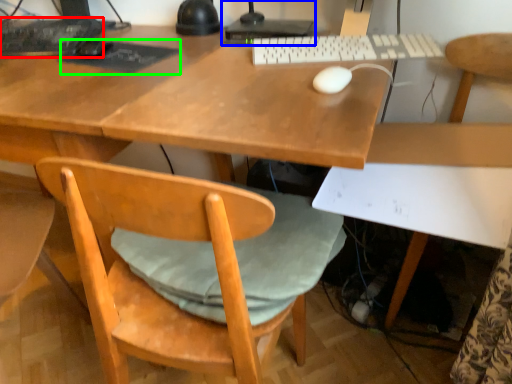
Question: Which object is the closest to the computer keyboard (highlighted by a red box)? Choose among these: desktop computer (highlighted by a blue box) or mousepad (highlighted by a green box).

Choices:
 (A) desktop computer
 (B) mousepad

Answer: (B)